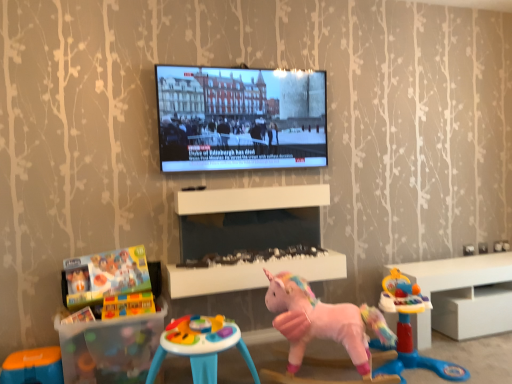
This screenshot has height=384, width=512. In order to click on free space above brick-like plastic blocks at lower left, marked as the 4th toy in a right-to-left arrangement (from a real-world perspective) in this screenshot , I will do `click(127, 290)`.